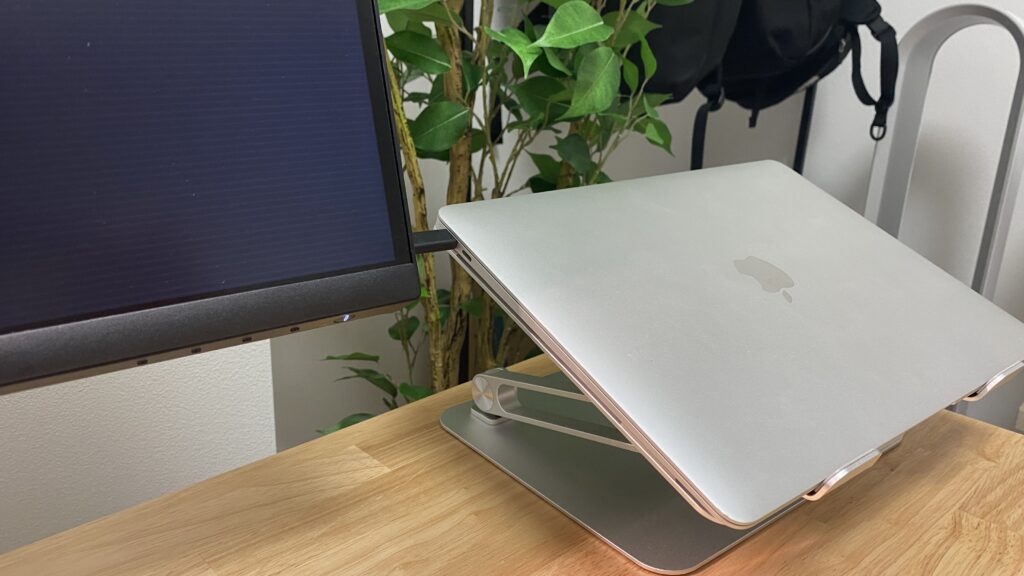
You are a GUI agent. You are given a task and a screenshot of the screen. Output one action in this format:
    pyautogui.click(x=<x>, y=<y>)
    Task: Click on the stand
    
    Given the screenshot: What is the action you would take?
    pyautogui.click(x=583, y=486)